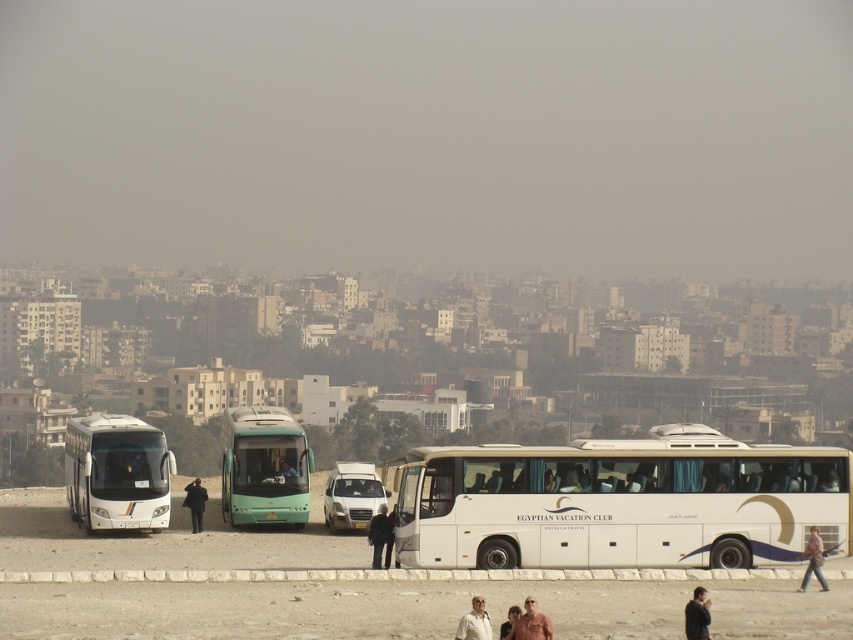
Question: Does white matte bus at center come behind black fabric coat at center?

Choices:
 (A) yes
 (B) no

Answer: (B)

Question: Observing the image, what is the correct spatial positioning of white fabric shirt at lower center in reference to black fabric coat at center?

Choices:
 (A) left
 (B) right

Answer: (B)

Question: Estimate the real-world distances between objects in this image. Which object is farther from the black fabric pants at center?

Choices:
 (A) black fabric person at lower right
 (B) brown textured shirt at lower center
 (C) white fabric shirt at lower center

Answer: (B)

Question: Does black fabric person at lower right appear over white fabric shirt at lower center?

Choices:
 (A) no
 (B) yes

Answer: (A)

Question: Which object is positioned closest to the black fabric person at lower right?

Choices:
 (A) light brown leather jacket at lower center
 (B) brown textured shirt at lower center
 (C) light brown leather jacket at center

Answer: (A)

Question: Which of the following is the farthest from the observer?

Choices:
 (A) pos(509,628)
 (B) pos(692,624)

Answer: (B)